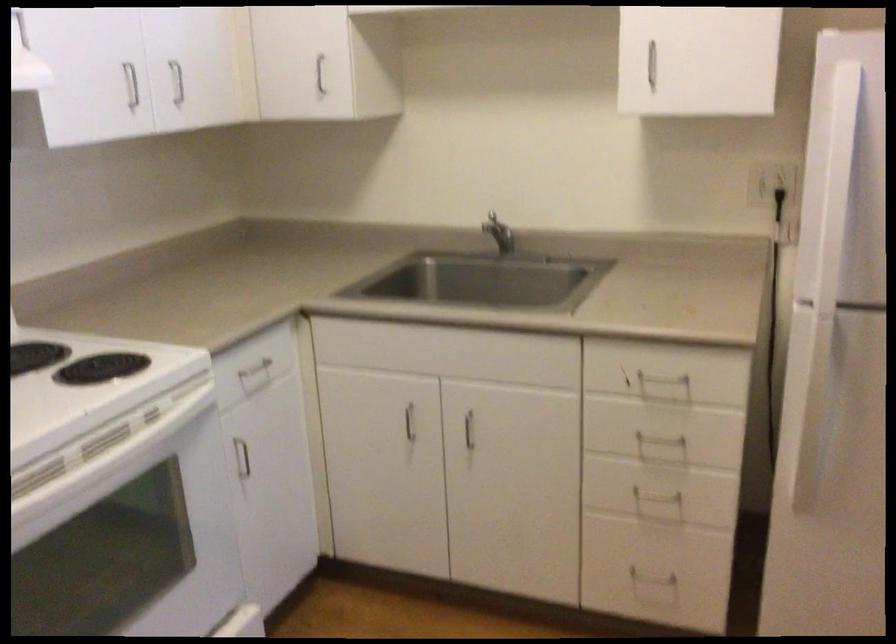
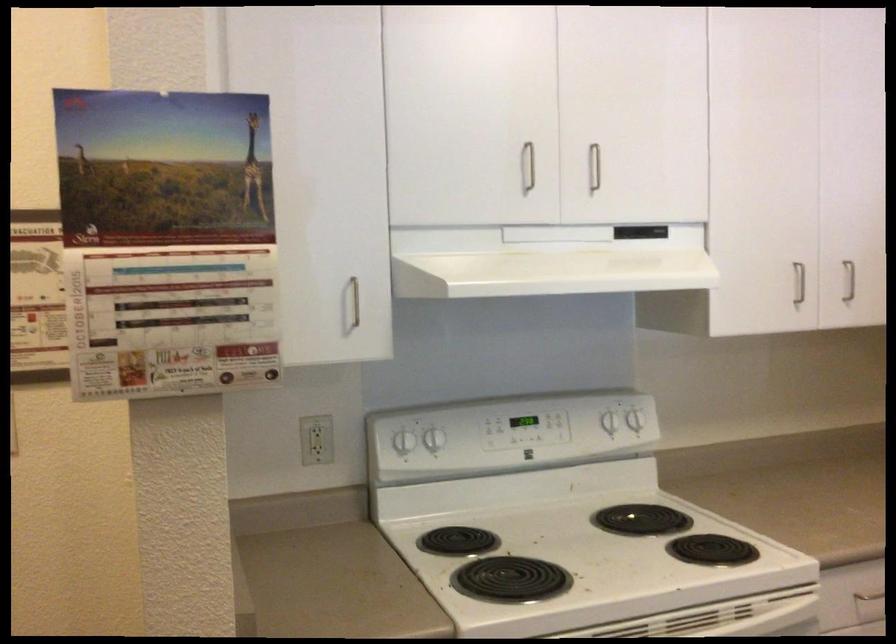
Where in the second image is the point corresponding to the point at 169,80 from the first image?

(849, 281)